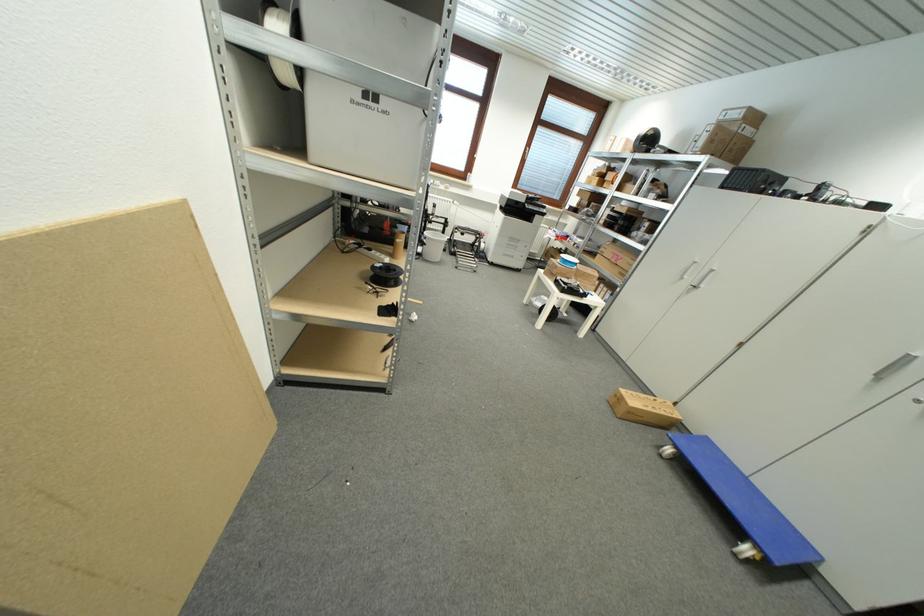
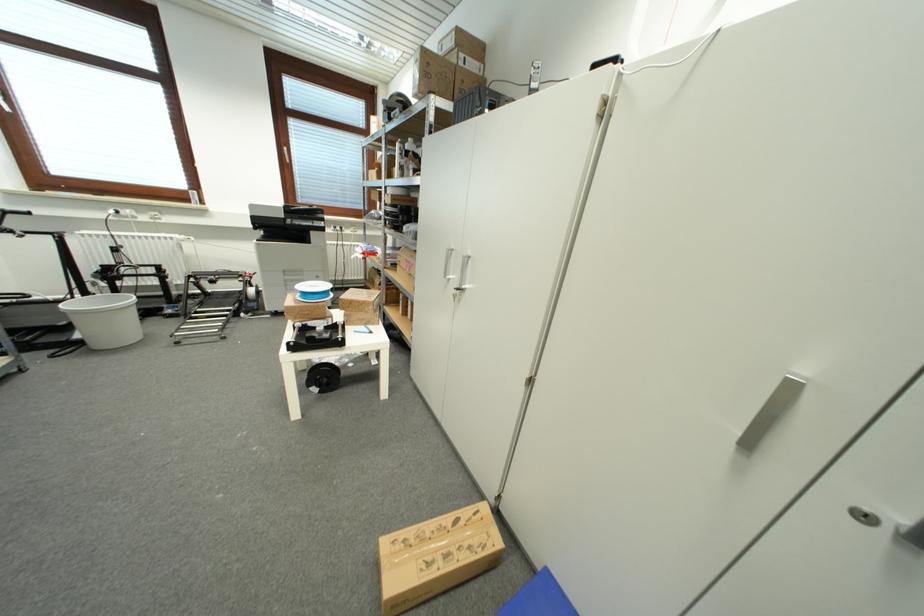
The images are taken continuously from a first-person perspective. In which direction are you moving?

The movement direction of the cameraman is right, forward.